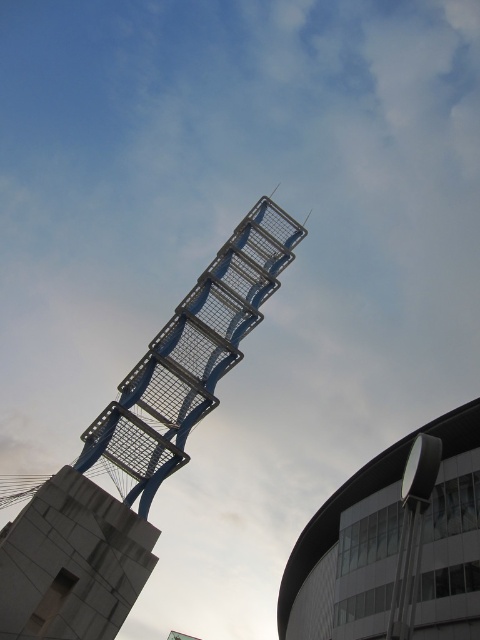
Which is more to the left, metallic grid tower at center or metallic silver tower at upper center?

metallic grid tower at center

Image resolution: width=480 pixels, height=640 pixels. What do you see at coordinates (190, 358) in the screenshot? I see `metallic grid tower at center` at bounding box center [190, 358].

In order to click on metallic grid tower at center in this screenshot , I will do `click(190, 358)`.